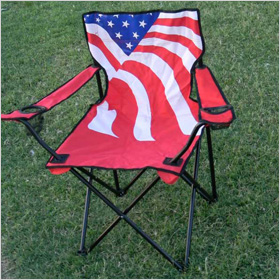
What are the coordinates of `black frame` in the screenshot? It's located at (39, 135), (119, 183), (214, 170).